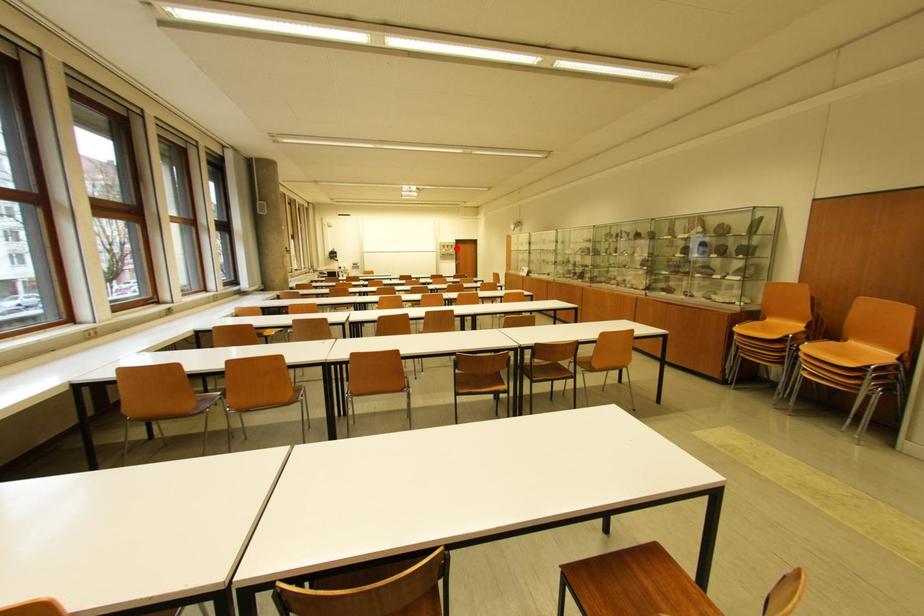
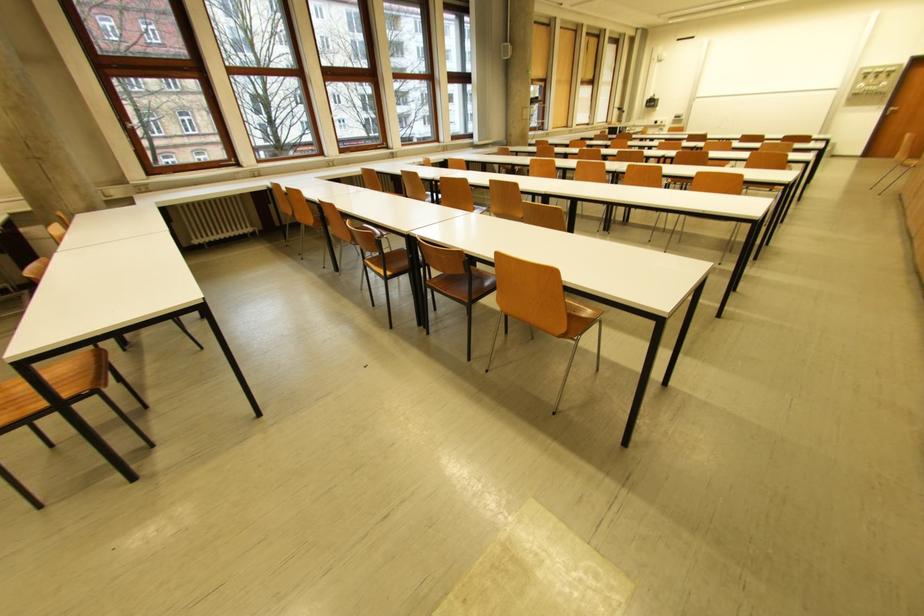
Where in the second image is the point corresponding to the highlighted location from the first image?

(890, 77)